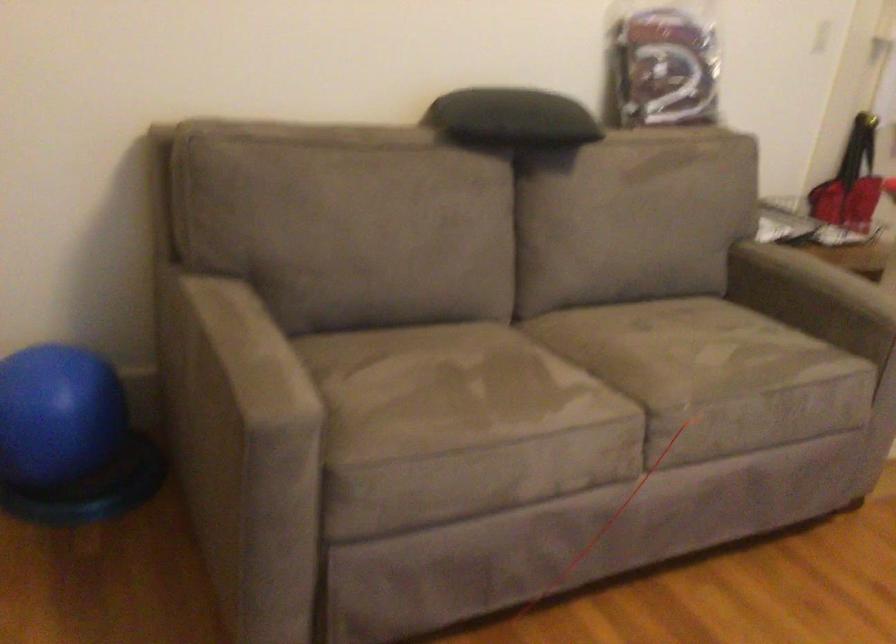
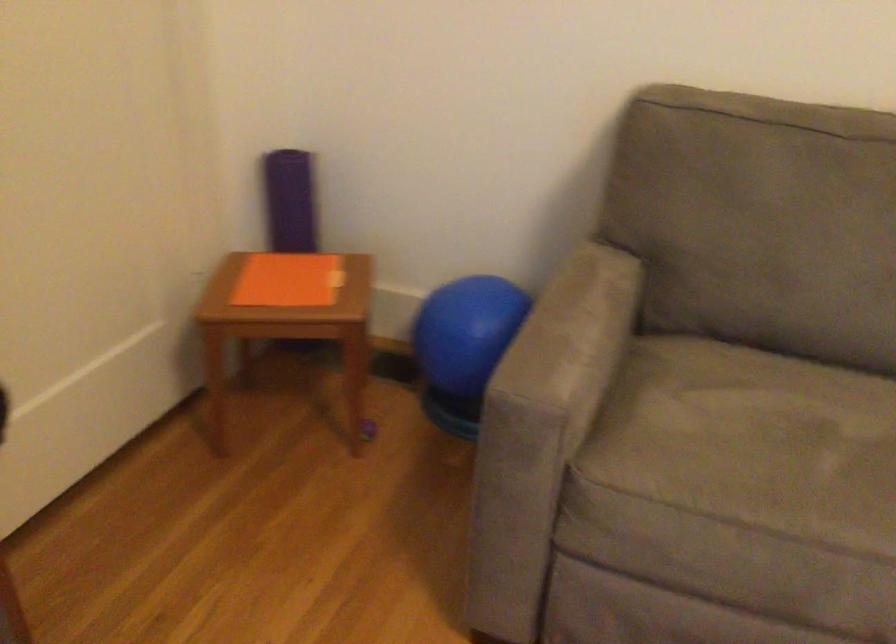
In the second image, find the point that corresponds to [426,393] in the first image.

(752, 442)